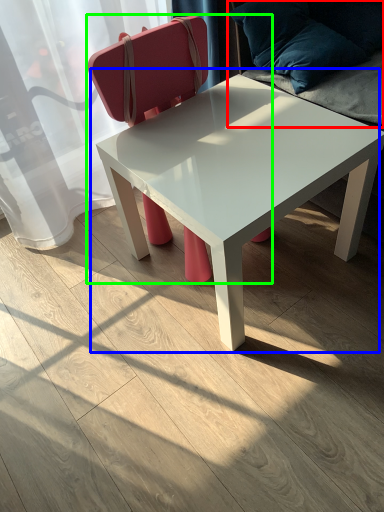
Question: Based on their relative distances, which object is nearer to swivel chair (highlighted by a red box)? Choose from coffee table (highlighted by a blue box) and chair (highlighted by a green box).

Choices:
 (A) coffee table
 (B) chair

Answer: (A)